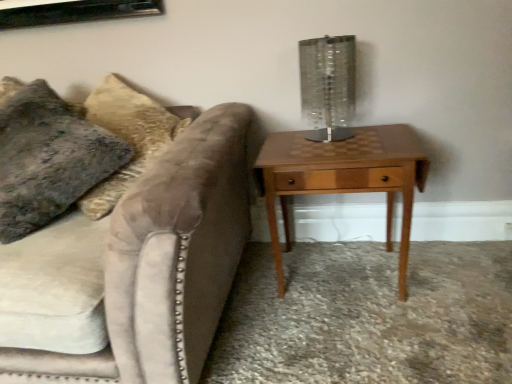
Identify the location of empty space that is to the right of woodenmaterial/texturenightstand at right. (455, 283).